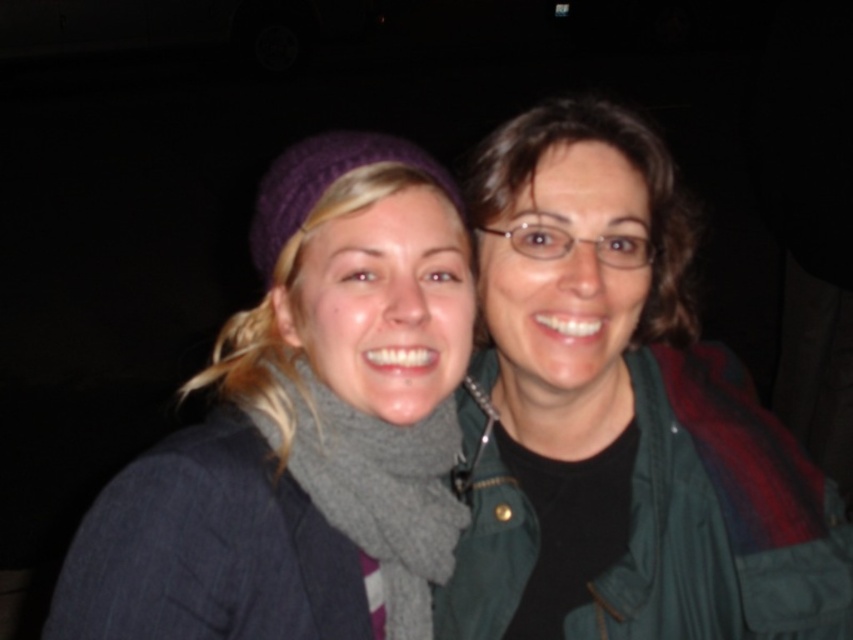
Question: Is green matte jacket at center above gray woolen scarf at center?

Choices:
 (A) no
 (B) yes

Answer: (B)

Question: In this image, where is gray wool scarf at center located relative to gray woolen scarf at center?

Choices:
 (A) left
 (B) right

Answer: (A)

Question: Which of the following is the farthest from the observer?

Choices:
 (A) (347, 486)
 (B) (561, 544)
 (C) (306, 499)

Answer: (B)

Question: Among these objects, which one is farthest from the camera?

Choices:
 (A) green matte jacket at upper right
 (B) green matte jacket at center
 (C) gray woolen scarf at center
 (D) gray wool scarf at center

Answer: (A)

Question: Does gray wool scarf at center have a larger size compared to green matte jacket at upper right?

Choices:
 (A) yes
 (B) no

Answer: (B)

Question: Which of these objects is positioned farthest from the green matte jacket at upper right?

Choices:
 (A) gray woolen scarf at center
 (B) gray wool scarf at center
 (C) purple knitted hat at upper left

Answer: (B)